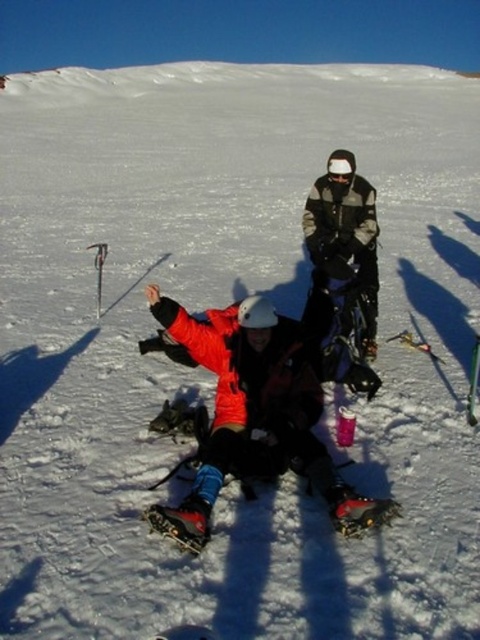
Does matte red jacket at center have a greater height compared to gray fleece jacket at upper center?

Yes, matte red jacket at center is taller than gray fleece jacket at upper center.

Can you confirm if matte red jacket at center is shorter than gray fleece jacket at upper center?

In fact, matte red jacket at center may be taller than gray fleece jacket at upper center.

Is point (276, 385) farther from camera compared to point (364, 204)?

No, it is in front of (364, 204).

The height and width of the screenshot is (640, 480). What are the coordinates of `matte red jacket at center` in the screenshot? It's located at (257, 410).

Between red plastic snowshoe at lower left and red rubber snowshoe at lower center, which one appears on the right side from the viewer's perspective?

red rubber snowshoe at lower center is more to the right.

In the scene shown: Can you confirm if red plastic snowshoe at lower left is smaller than red rubber snowshoe at lower center?

Actually, red plastic snowshoe at lower left might be larger than red rubber snowshoe at lower center.

Is point (180, 509) positioned behind point (337, 525)?

No, it is in front of (337, 525).

Locate an element on the screen. Image resolution: width=480 pixels, height=640 pixels. red plastic snowshoe at lower left is located at coordinates 182,522.

Is gray fleece jacket at upper center above metallic ski at center?

Yes.

Is gray fleece jacket at upper center bigger than metallic ski at center?

No, gray fleece jacket at upper center is not bigger than metallic ski at center.

Find the location of `gray fleece jacket at upper center`. gray fleece jacket at upper center is located at coordinates (345, 234).